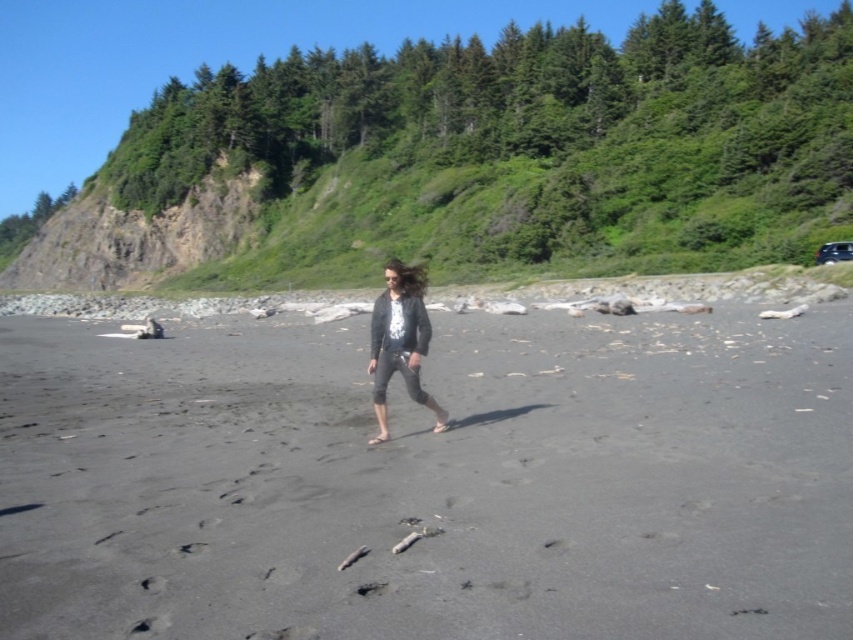
You are planning to take a photo of the green leafy hillside at upper center and the dark gray knit sweater at center. Which object should you focus on first if you want to capture both in the same frame without moving the camera?

The dark gray knit sweater at center is closer to the camera than the green leafy hillside at upper center, so you should focus on the dark gray knit sweater at center first to ensure both are in focus.

You are a hiker planning to descend from the green leafy hillside at upper center to the dark gray sand at center. Based on the scene, which direction should you head to reach the sand?

You should head downward towards the dark gray sand at center from the green leafy hillside at upper center since the sand is located below the hillside.

You are standing at the beach and want to take a photo of both the point at coordinates point (755, 371) and point (415, 388). Which point is closer to your camera when you take the photo?

Point (415, 388) is closer to the camera than point (755, 371) because point (755, 371) is further away from the camera.